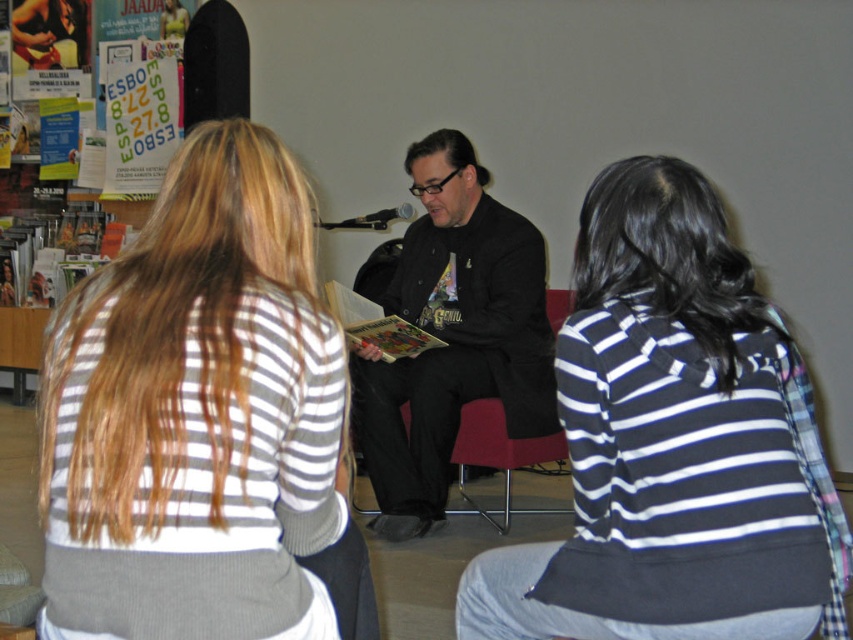
Question: Can you confirm if striped sweater at center is smaller than black and white striped sweater at center?

Choices:
 (A) no
 (B) yes

Answer: (B)

Question: Which point is farther from the camera taking this photo?

Choices:
 (A) (45, 412)
 (B) (799, 515)
 (C) (473, 156)

Answer: (C)

Question: Is black and white striped sweater at center further to camera compared to matte black jacket at center?

Choices:
 (A) yes
 (B) no

Answer: (B)

Question: Among these objects, which one is farthest from the camera?

Choices:
 (A) striped sweater at center
 (B) black and white striped sweater at center

Answer: (B)

Question: Does striped sweater at center have a greater width compared to black and white striped sweater at center?

Choices:
 (A) no
 (B) yes

Answer: (A)

Question: Which of the following is the farthest from the observer?

Choices:
 (A) striped sweater at center
 (B) matte black jacket at center
 (C) black and white striped sweater at center

Answer: (B)